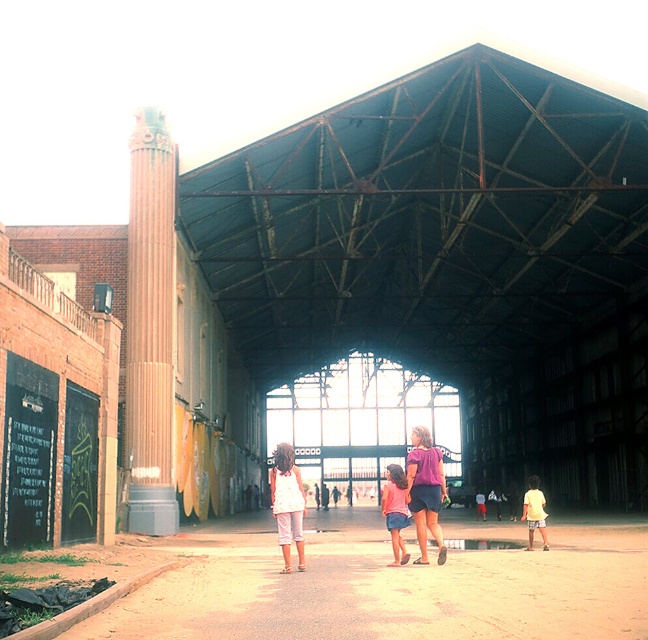
Does purple fabric shirt at center have a greater height compared to denim shorts at center?

No.

Between point (434, 468) and point (391, 486), which one is positioned in front?

Positioned in front is point (434, 468).

Where is `purple fabric shirt at center`? purple fabric shirt at center is located at coordinates (424, 490).

Is rustic stone column at left taller than denim shorts at center?

In fact, rustic stone column at left may be shorter than denim shorts at center.

Between rustic stone column at left and denim shorts at center, which one appears on the left side from the viewer's perspective?

rustic stone column at left is more to the left.

This screenshot has width=648, height=640. What are the coordinates of `rustic stone column at left` in the screenshot? It's located at (150, 324).

From the picture: Which is below, black chalkboard at left or denim shorts at center?

denim shorts at center is below.

Between point (25, 532) and point (397, 536), which one is positioned behind?

The point (25, 532) is more distant.

This screenshot has height=640, width=648. What are the coordinates of `black chalkboard at left` in the screenshot? It's located at (29, 452).